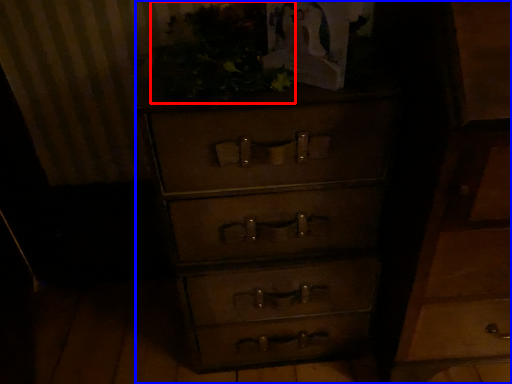
Question: Which object appears farthest to the camera in this image, vegetation (highlighted by a red box) or chest of drawers (highlighted by a blue box)?

Choices:
 (A) vegetation
 (B) chest of drawers

Answer: (B)